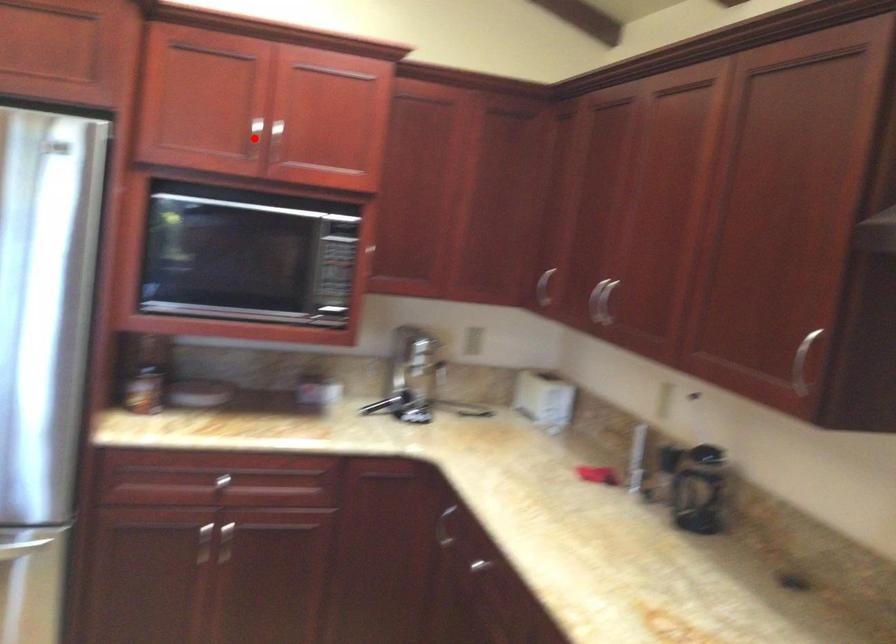
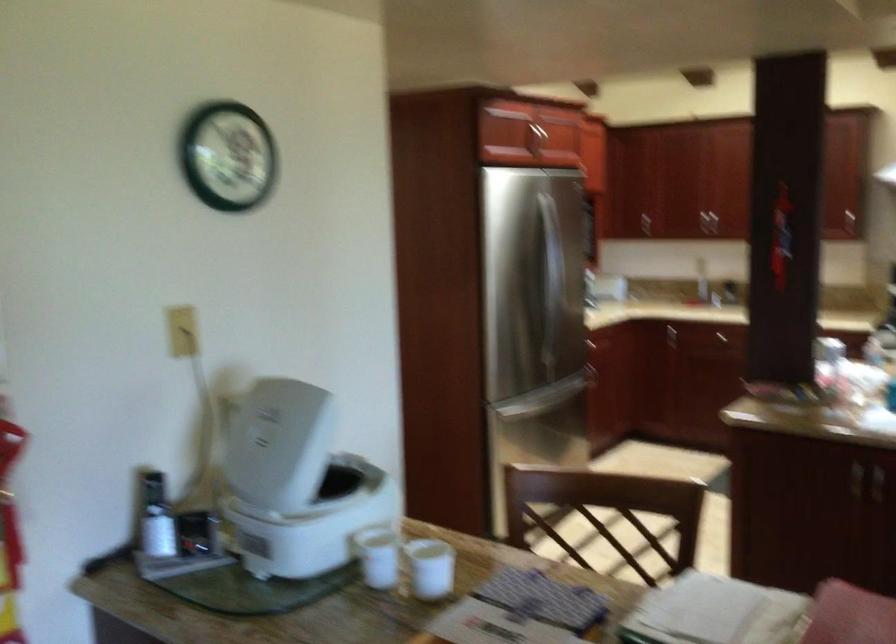
Question: I am providing you with two images of the same scene from different viewpoints. A red point is marked on the first image. At the location where the point appears in image 1, is it still visible in image 2?

Choices:
 (A) Yes
 (B) No

Answer: (B)